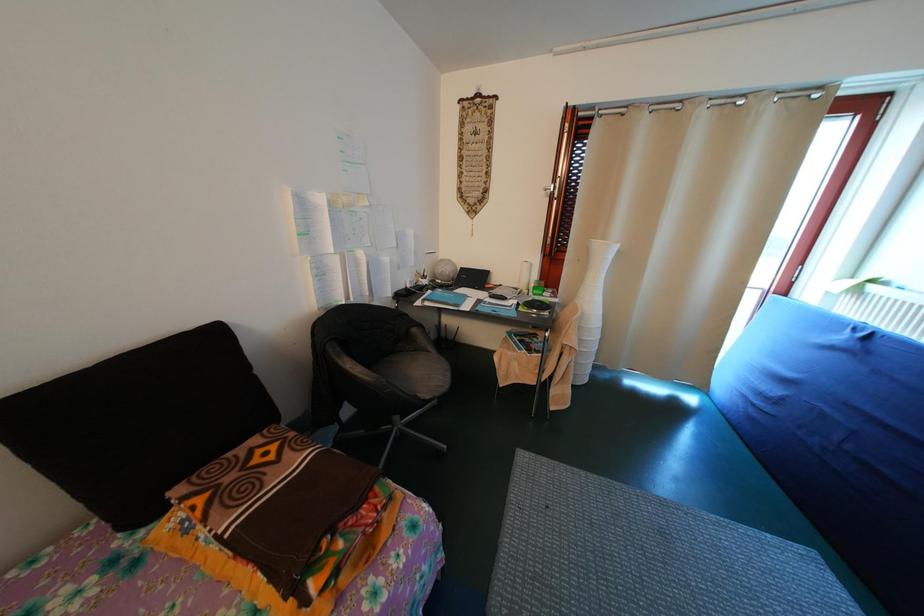
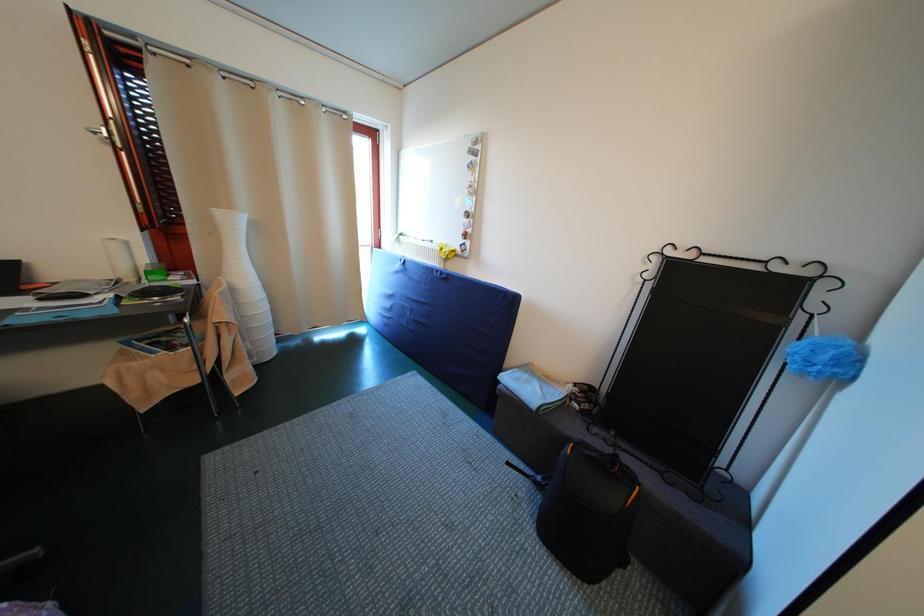
Question: The camera is either moving clockwise (left) or counter-clockwise (right) around the object. The first image is from the beginning of the video and the second image is from the end. Is the camera moving left or right when shooting the video?

Choices:
 (A) Left
 (B) Right

Answer: (A)